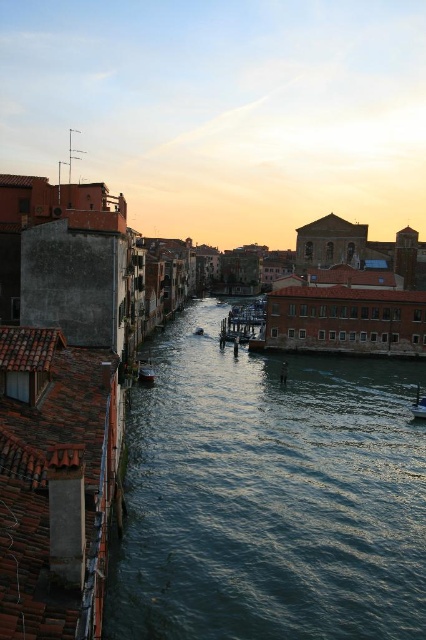
Question: Which object appears farthest from the camera in this image?

Choices:
 (A) wooden polished boat at center
 (B) metallic silver boat at center

Answer: (A)

Question: Is wooden polished boat at center to the right of metallic silver boat at center from the viewer's perspective?

Choices:
 (A) no
 (B) yes

Answer: (A)

Question: Estimate the real-world distances between objects in this image. Which object is farther from the metallic silver boat at center?

Choices:
 (A) wooden polished boat at center
 (B) greenish water at center

Answer: (A)

Question: Does greenish water at center have a larger size compared to metallic silver boat at center?

Choices:
 (A) no
 (B) yes

Answer: (B)

Question: Which point is closer to the camera taking this photo?

Choices:
 (A) (411, 412)
 (B) (138, 371)
 (C) (425, 636)

Answer: (C)

Question: Can you confirm if wooden polished boat at center is smaller than metallic silver boat at center?

Choices:
 (A) yes
 (B) no

Answer: (A)